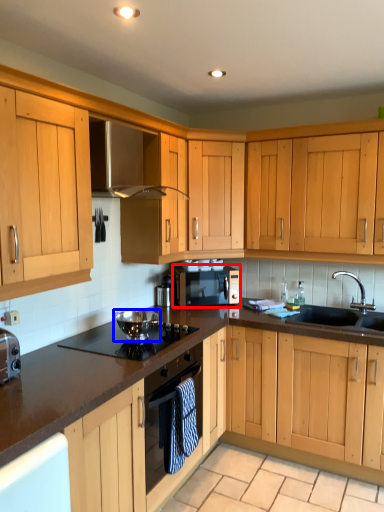
Question: Which object appears closest to the camera in this image, microwave oven (highlighted by a red box) or appliance (highlighted by a blue box)?

Choices:
 (A) microwave oven
 (B) appliance

Answer: (B)